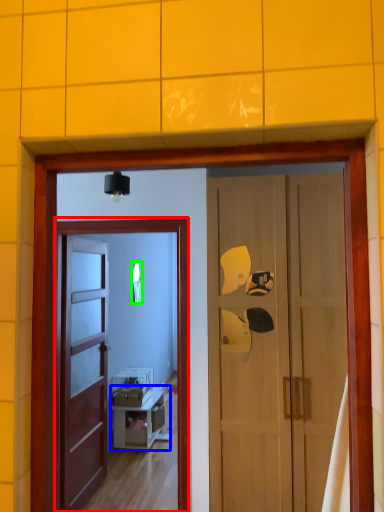
Question: Which is farther away from screen door (highlighted by a red box)? cabinetry (highlighted by a blue box) or mirror (highlighted by a green box)?

Choices:
 (A) cabinetry
 (B) mirror

Answer: (A)